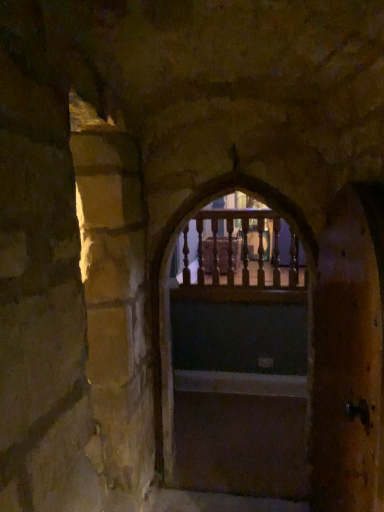
Question: Is smooth wooden stairs at center facing away from wooden railing at center?

Choices:
 (A) yes
 (B) no

Answer: (B)

Question: Considering the relative sizes of smooth wooden stairs at center and wooden railing at center in the image provided, is smooth wooden stairs at center shorter than wooden railing at center?

Choices:
 (A) no
 (B) yes

Answer: (B)

Question: Is smooth wooden stairs at center aimed at wooden railing at center?

Choices:
 (A) yes
 (B) no

Answer: (B)

Question: From the image's perspective, is smooth wooden stairs at center above wooden railing at center?

Choices:
 (A) no
 (B) yes

Answer: (A)

Question: From a real-world perspective, is smooth wooden stairs at center on wooden railing at center?

Choices:
 (A) no
 (B) yes

Answer: (A)

Question: Is smooth wooden stairs at center positioned in front of wooden railing at center?

Choices:
 (A) yes
 (B) no

Answer: (B)

Question: Is wooden railing at center next to wooden door at right and touching it?

Choices:
 (A) yes
 (B) no

Answer: (B)

Question: Considering the relative sizes of wooden railing at center and wooden door at right in the image provided, is wooden railing at center thinner than wooden door at right?

Choices:
 (A) no
 (B) yes

Answer: (A)

Question: Can you confirm if wooden railing at center is positioned to the left of wooden door at right?

Choices:
 (A) yes
 (B) no

Answer: (A)

Question: Is the depth of wooden railing at center greater than that of wooden door at right?

Choices:
 (A) yes
 (B) no

Answer: (A)

Question: Can you confirm if wooden railing at center is bigger than wooden door at right?

Choices:
 (A) yes
 (B) no

Answer: (A)

Question: From the image's perspective, is wooden railing at center under wooden door at right?

Choices:
 (A) yes
 (B) no

Answer: (B)

Question: From the image's perspective, does wooden railing at center appear higher than wooden railing at center?

Choices:
 (A) no
 (B) yes

Answer: (A)